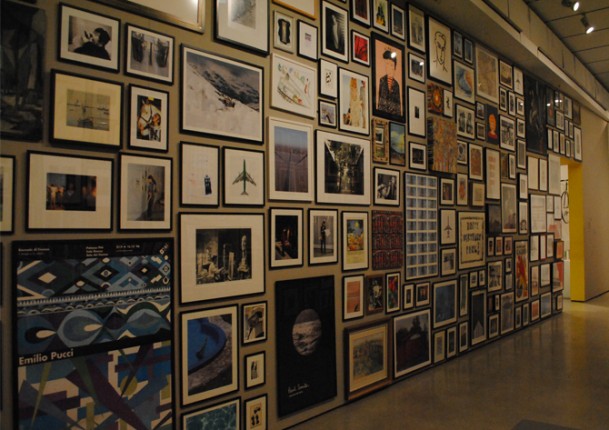
Where is `mat`? The image size is (609, 430). mat is located at coordinates (525, 421).